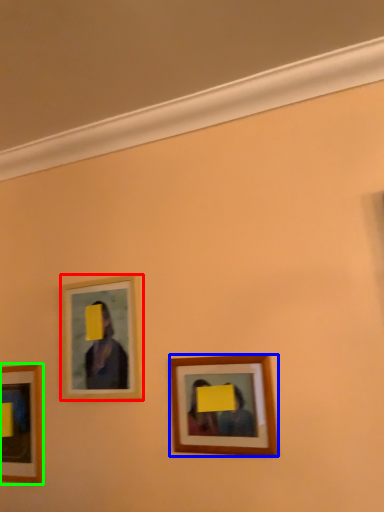
Question: Which is farther away from picture frame (highlighted by a red box)? picture frame (highlighted by a blue box) or picture frame (highlighted by a green box)?

Choices:
 (A) picture frame
 (B) picture frame

Answer: (A)